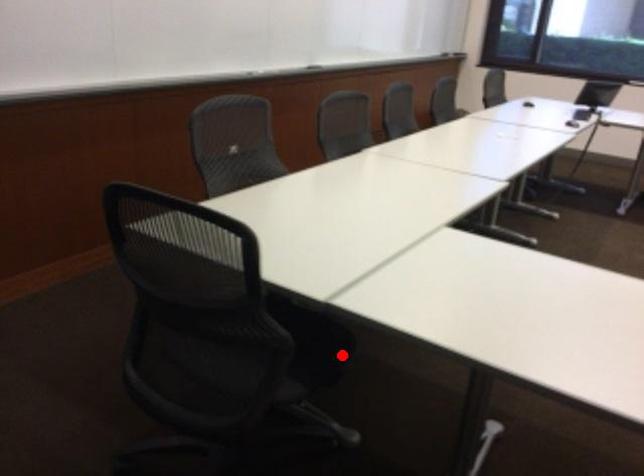
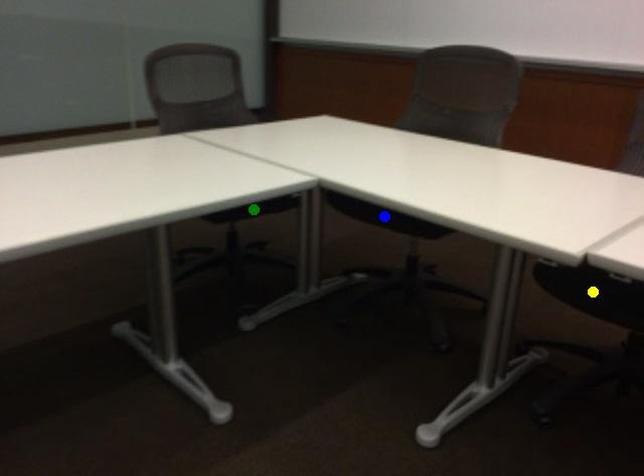
Question: I am providing you with two images of the same scene from different viewpoints. A red point is marked on the first image. You are given multiple points on the second image. Which point in image 2 represents the same 3d spot as the red point in image 1?

Choices:
 (A) blue point
 (B) green point
 (C) yellow point

Answer: (B)